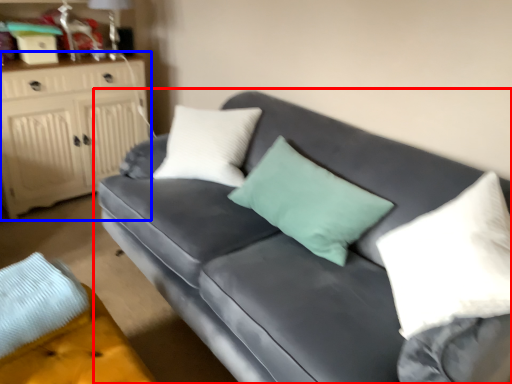
Question: Which object is closer to the camera taking this photo, studio couch (highlighted by a red box) or cabinetry (highlighted by a blue box)?

Choices:
 (A) studio couch
 (B) cabinetry

Answer: (A)